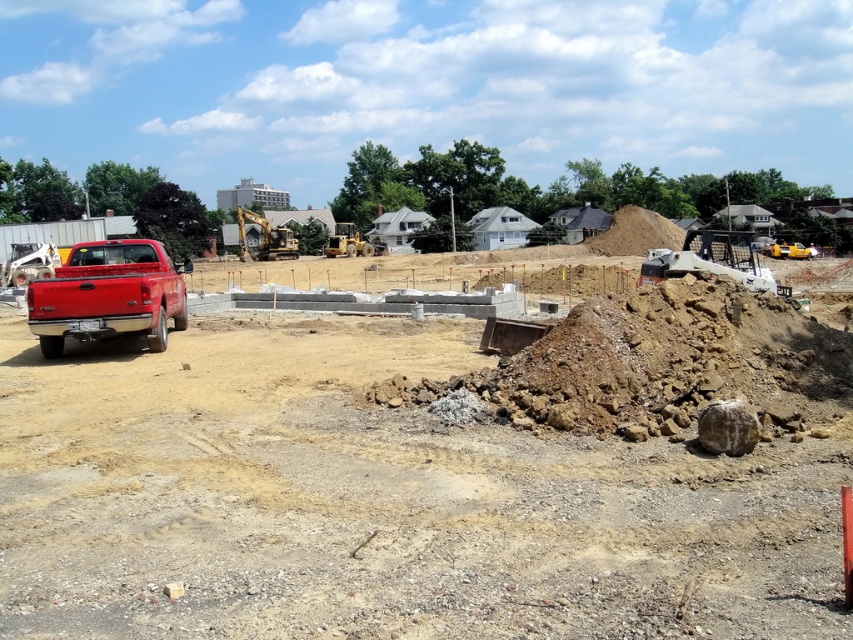
Looking at this image, is matte red truck at left to the right of metallic silver excavator at right from the viewer's perspective?

In fact, matte red truck at left is to the left of metallic silver excavator at right.

Is point (129, 248) farther from camera compared to point (688, 262)?

No, it is in front of (688, 262).

Which is in front, point (119, 273) or point (730, 272)?

Positioned in front is point (119, 273).

This screenshot has height=640, width=853. In order to click on matte red truck at left in this screenshot , I will do `click(108, 296)`.

Where is `matte red truck at left`? matte red truck at left is located at coordinates point(108,296).

Locate an element on the screen. Image resolution: width=853 pixels, height=640 pixels. matte red truck at left is located at coordinates click(108, 296).

Is metallic silver excavator at right in front of yellow metallic excavator at center?

Yes, metallic silver excavator at right is closer to the viewer.

Which is behind, point (740, 269) or point (285, 257)?

The point (285, 257) is behind.

This screenshot has height=640, width=853. I want to click on metallic silver excavator at right, so click(711, 260).